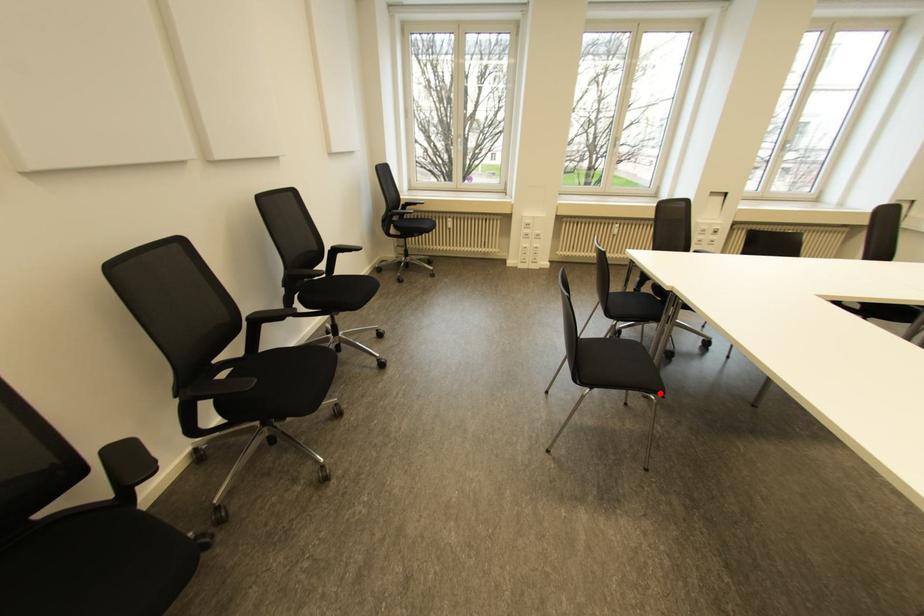
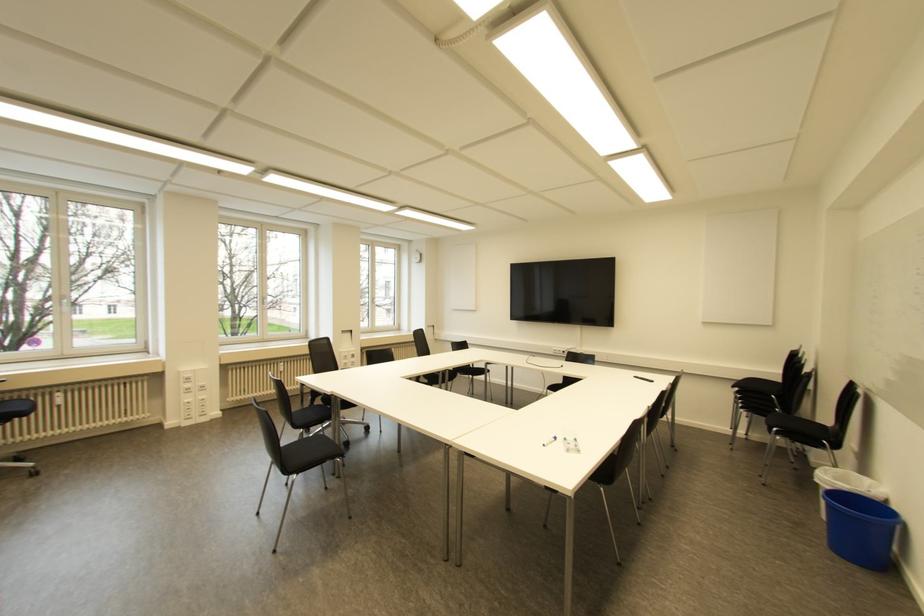
Question: I am providing you with two images of the same scene from different viewpoints. A red point is shown in image1. For the corresponding object point in image2, is it positioned nearer or farther from the camera?

Choices:
 (A) Nearer
 (B) Farther

Answer: (A)